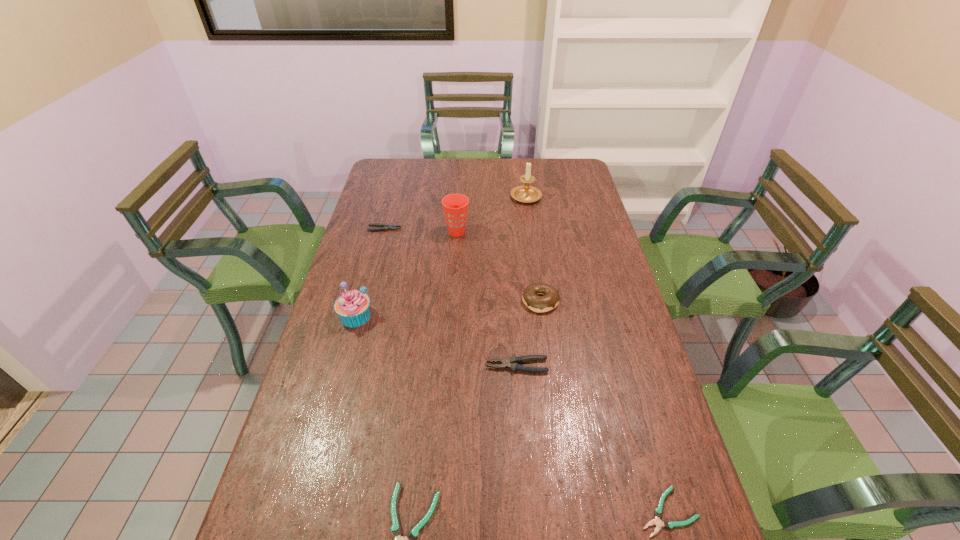
Where is `pliers that can be found as the third closest to the doughnut`? pliers that can be found as the third closest to the doughnut is located at coordinates (385, 227).

Locate an element on the screen. The width and height of the screenshot is (960, 540). free location that satisfies the following two spatial constraints: 1. at the gripping part of the tallest pliers; 2. on the right side of the rightmost pliers is located at coordinates (528, 511).

At what (x,y) coordinates should I click in order to perform the action: click on vacant position in the image that satisfies the following two spatial constraints: 1. at the gripping part of the brown doughnut; 2. on the right side of the left gray pliers. Please return your answer as a coordinate pair (x, y). The image size is (960, 540). Looking at the image, I should click on (366, 301).

The height and width of the screenshot is (540, 960). I want to click on vacant space that satisfies the following two spatial constraints: 1. at the gripping part of the leftmost pliers; 2. on the right side of the shortest object, so click(310, 511).

At what (x,y) coordinates should I click in order to perform the action: click on vacant space that satisfies the following two spatial constraints: 1. at the gripping part of the farthest pliers; 2. on the left side of the shortest pliers. Please return your answer as a coordinate pair (x, y). Image resolution: width=960 pixels, height=540 pixels. Looking at the image, I should click on click(310, 511).

Where is `blank space that satisfies the following two spatial constraints: 1. at the gripping part of the sixth tallest object; 2. on the left side of the fifth shortest object`? The image size is (960, 540). blank space that satisfies the following two spatial constraints: 1. at the gripping part of the sixth tallest object; 2. on the left side of the fifth shortest object is located at coordinates (366, 301).

Where is `blank area in the image that satisfies the following two spatial constraints: 1. on the front side of the brown doughnut; 2. at the gripping part of the right gray pliers`? This screenshot has height=540, width=960. blank area in the image that satisfies the following two spatial constraints: 1. on the front side of the brown doughnut; 2. at the gripping part of the right gray pliers is located at coordinates (549, 366).